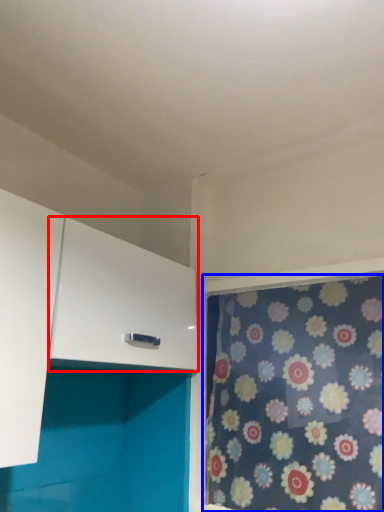
Question: Which of the following is the farthest to the observer, cabinetry (highlighted by a red box) or curtain (highlighted by a blue box)?

Choices:
 (A) cabinetry
 (B) curtain

Answer: (B)